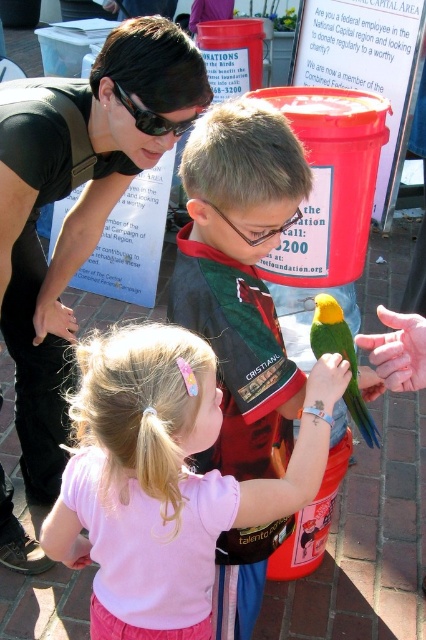
You are a photographer at the event and want to capture a photo of the pale pink fabric at center and the black plastic goggles at upper center. Based on their positions, which object should you focus on first to ensure both are in the frame?

The pale pink fabric at center is positioned on the right side of black plastic goggles at upper center, so you should focus on the black plastic goggles at upper center first to ensure both objects are included in the frame.